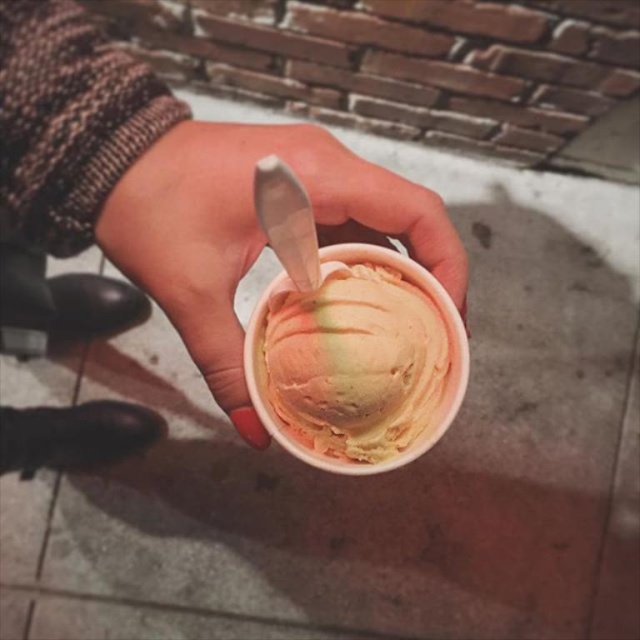
You are trying to take a photo of the pastel swirl ice cream at center. However, the matte plastic cup at center is blocking your view. Can you move the cup to the side to get a clear shot of the ice cream?

The pastel swirl ice cream at center is behind the matte plastic cup at center, so moving the cup to the side would allow you to see the ice cream clearly.

You are at an ice cream shop and want to know if the pastel swirl ice cream at center will fit into the matte plastic cup at center. Can you determine if the ice cream will fit based on their widths?

The matte plastic cup at center is wider than the pastel swirl ice cream at center, so the ice cream will fit into the cup.

You are at an ice cream shop and want to know if the pastel swirl ice cream at center will fit into the matte plastic cup at center. Can you confirm based on their sizes?

The matte plastic cup at center is much taller than the pastel swirl ice cream at center, so yes, the ice cream will fit comfortably inside the cup.